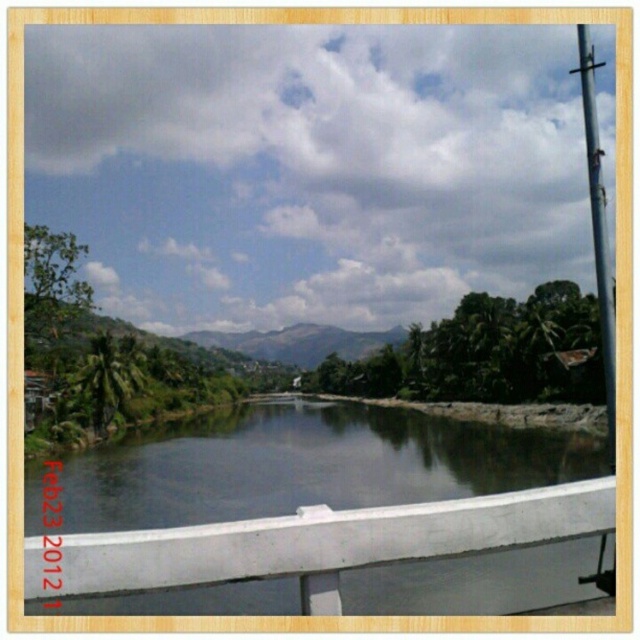
You are a photographer planning to capture a shot of the clear water at center and the metallic pole at right. Based on their positions, which object would appear closer to the left side of your photo?

The clear water at center is positioned to the left of the metallic pole at right, so it would appear closer to the left side of the photo.